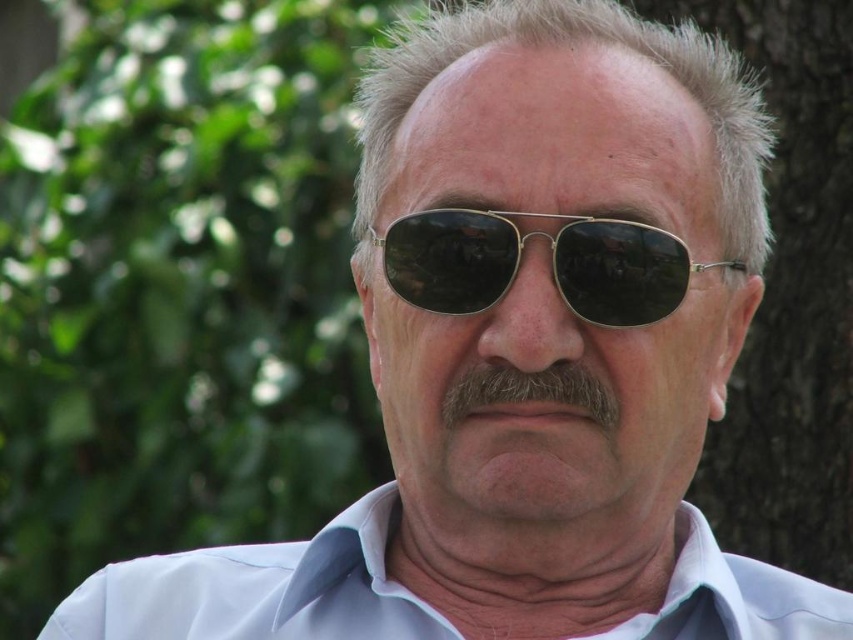
Question: Which point appears closest to the camera in this image?

Choices:
 (A) (535, 385)
 (B) (640, 252)
 (C) (572, 38)
 (D) (508, 376)

Answer: (A)

Question: Which object is closer to the camera taking this photo?

Choices:
 (A) gray matte hair at center
 (B) white cotton dress shirt at center
 (C) gray/soft hair at center

Answer: (C)

Question: Considering the relative positions of gold metallic aviator sunglasses at center and gray/soft hair at center in the image provided, where is gold metallic aviator sunglasses at center located with respect to gray/soft hair at center?

Choices:
 (A) left
 (B) right

Answer: (B)

Question: Among these objects, which one is farthest from the camera?

Choices:
 (A) gray/soft hair at center
 (B) gold metallic aviator sunglasses at center
 (C) gray matte hair at center
 (D) gray fuzzy beard at center

Answer: (C)

Question: Where is white cotton dress shirt at center located in relation to gray/soft hair at center in the image?

Choices:
 (A) left
 (B) right

Answer: (A)

Question: Is gold metallic aviator sunglasses at center wider than gray fuzzy beard at center?

Choices:
 (A) no
 (B) yes

Answer: (B)